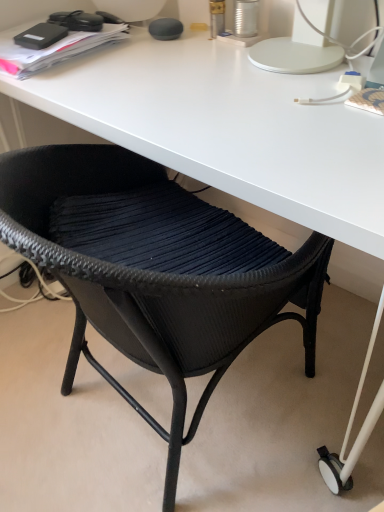
Identify the location of free spot above black woven chair at lower center (from a real-world perspective). Image resolution: width=384 pixels, height=512 pixels. (200, 126).